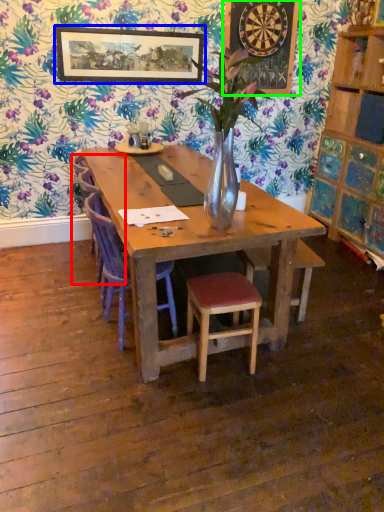
Question: Estimate the real-world distances between objects in this image. Which object is farther from armchair (highlighted by a red box), picture frame (highlighted by a blue box) or bulletin board (highlighted by a green box)?

Choices:
 (A) picture frame
 (B) bulletin board

Answer: (B)